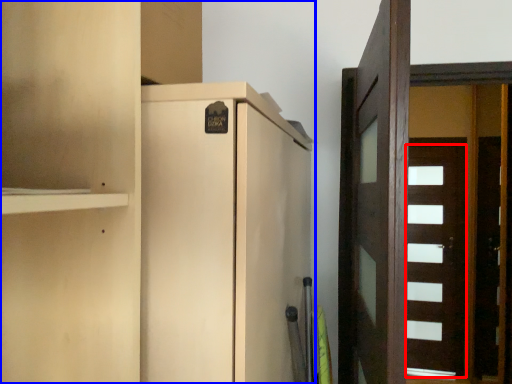
Question: Which object is further to the camera taking this photo, door (highlighted by a red box) or cupboard (highlighted by a blue box)?

Choices:
 (A) door
 (B) cupboard

Answer: (A)